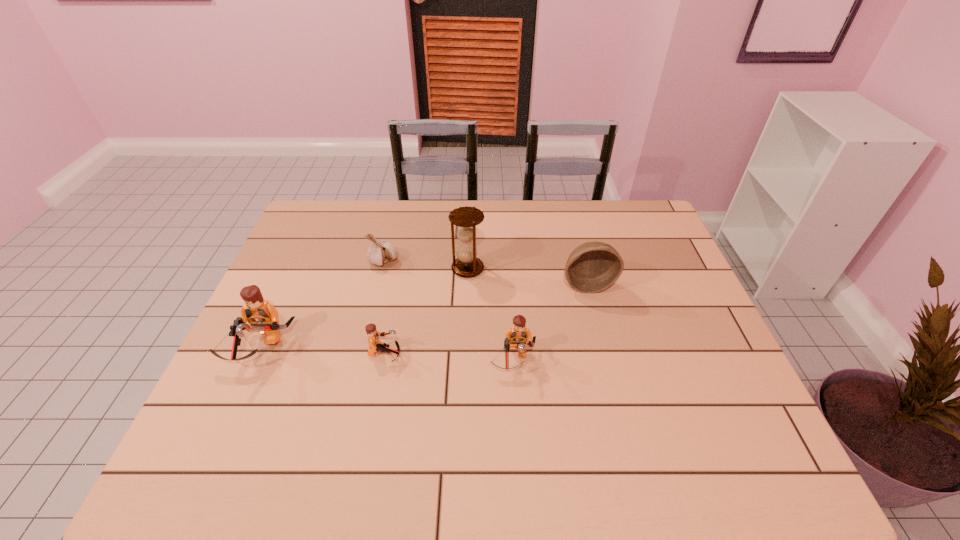
This screenshot has width=960, height=540. Identify the location of vacant spot to place a Lego on the right. (644, 366).